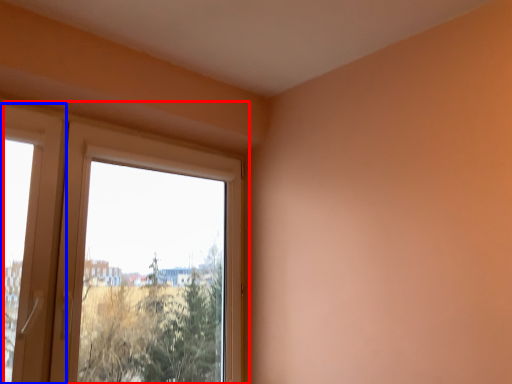
Question: Among these objects, which one is nearest to the camera, window (highlighted by a red box) or screen door (highlighted by a blue box)?

Choices:
 (A) window
 (B) screen door

Answer: (B)